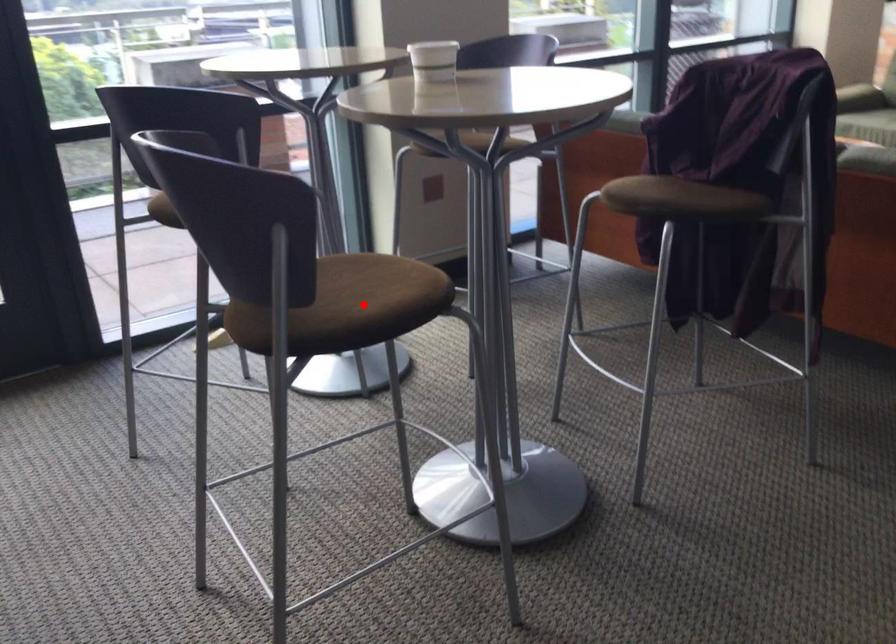
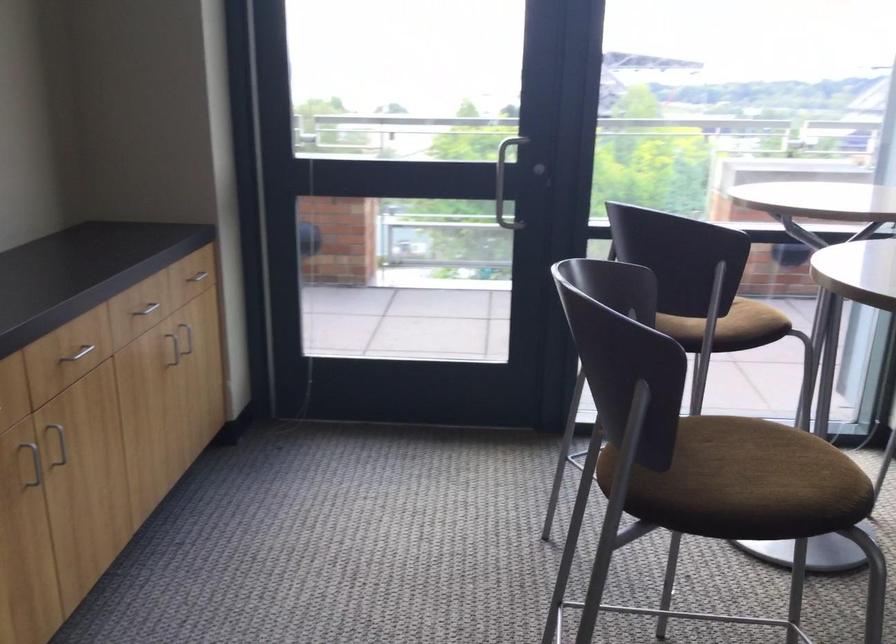
Question: A red point is marked in image1. In image2, is the corresponding 3D point closer to the camera or farther? Reply with the corresponding letter.

Choices:
 (A) The corresponding 3D point is closer.
 (B) The corresponding 3D point is farther.

Answer: (A)